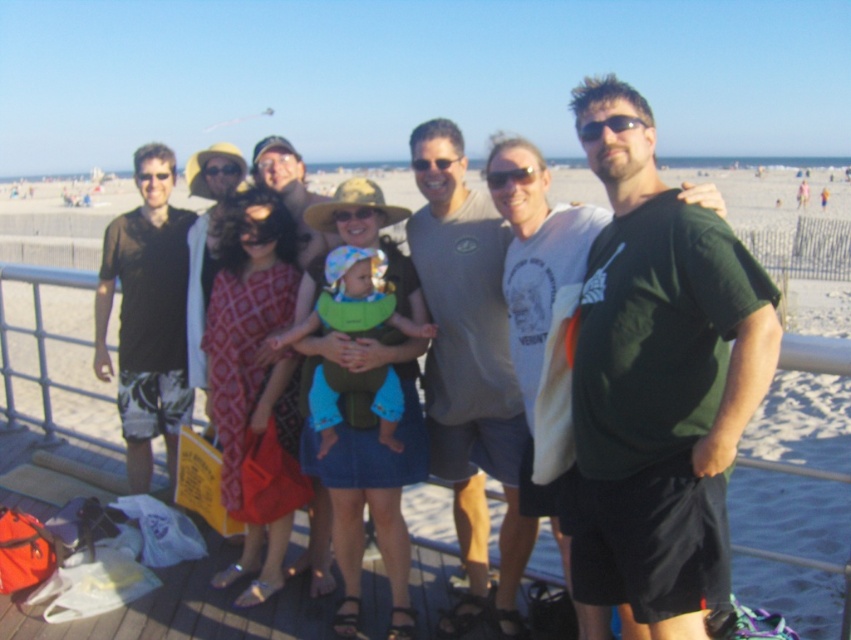
Question: Is matte black t-shirt at center in front of dark green t-shirt at center?

Choices:
 (A) yes
 (B) no

Answer: (A)

Question: Is matte black t-shirt at center wider than black fabric shirt at left?

Choices:
 (A) no
 (B) yes

Answer: (B)

Question: Among these objects, which one is nearest to the camera?

Choices:
 (A) black fabric shirt at left
 (B) matte black t-shirt at center
 (C) dark green t-shirt at center

Answer: (B)

Question: Can you confirm if dark green t-shirt at center is positioned to the right of gray cotton t-shirt at center?

Choices:
 (A) no
 (B) yes

Answer: (B)

Question: Which point is closer to the camera?

Choices:
 (A) black fabric shirt at left
 (B) dark green t-shirt at center

Answer: (B)

Question: Which point is farther to the camera?

Choices:
 (A) gray cotton t-shirt at center
 (B) dark green t-shirt at center

Answer: (A)